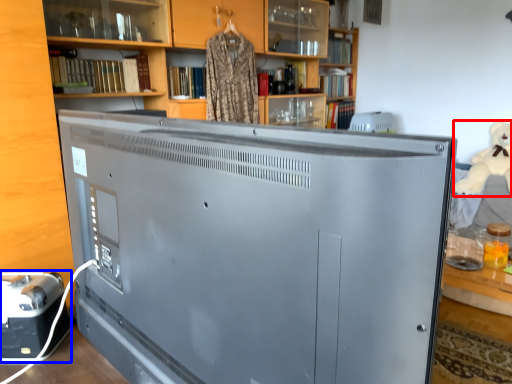
Question: Which point is closer to the camera, toy (highlighted by a red box) or appliance (highlighted by a blue box)?

Choices:
 (A) toy
 (B) appliance

Answer: (B)